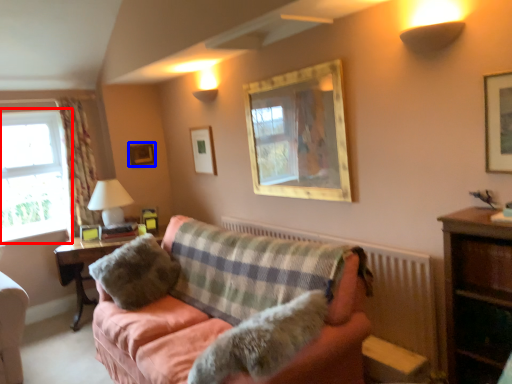
Question: Which object appears farthest to the camera in this image, window (highlighted by a red box) or picture frame (highlighted by a blue box)?

Choices:
 (A) window
 (B) picture frame

Answer: (B)